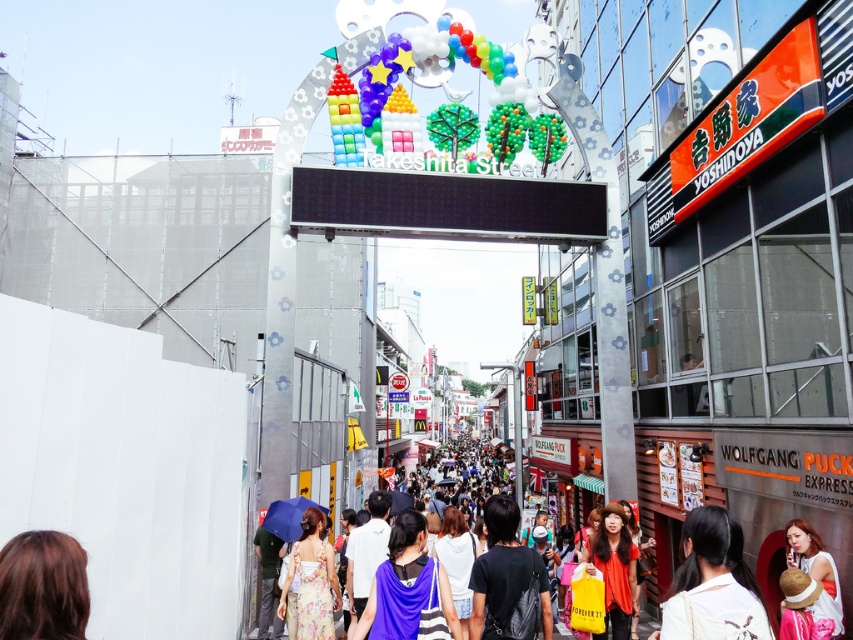
Is multicolored fabric crowd at center further to the viewer compared to purple fabric bag at center?

No, it is in front of purple fabric bag at center.

What are the coordinates of `multicolored fabric crowd at center` in the screenshot? It's located at (757, 520).

Is point (76, 605) farther from camera compared to point (329, 616)?

No, (76, 605) is closer to viewer.

Which is behind, point (53, 605) or point (331, 630)?

The point (331, 630) is more distant.

Which is in front, point (67, 577) or point (287, 580)?

Point (67, 577) is in front.

This screenshot has width=853, height=640. In order to click on brown hair at lower left in this screenshot , I will do `click(42, 586)`.

Does multicolored fabric crowd at center lie behind floral fabric dress at lower center?

No, multicolored fabric crowd at center is in front of floral fabric dress at lower center.

Does multicolored fabric crowd at center appear on the right side of floral fabric dress at lower center?

Indeed, multicolored fabric crowd at center is positioned on the right side of floral fabric dress at lower center.

Does point (712, 467) lie in front of point (305, 600)?

No, (712, 467) is behind (305, 600).

You are a GUI agent. You are given a task and a screenshot of the screen. Output one action in this format:
    pyautogui.click(x=<x>, y=<y>)
    Task: Click on the multicolored fabric crowd at center
    Image resolution: width=853 pixels, height=640 pixels.
    Given the screenshot: What is the action you would take?
    pyautogui.click(x=757, y=520)